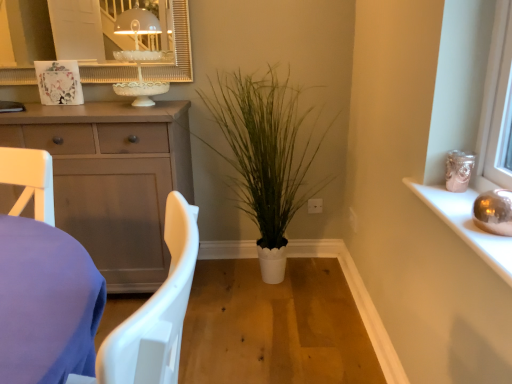
Where is `free space in front of white porcelain candle holder at upper center`? The width and height of the screenshot is (512, 384). free space in front of white porcelain candle holder at upper center is located at coordinates (117, 113).